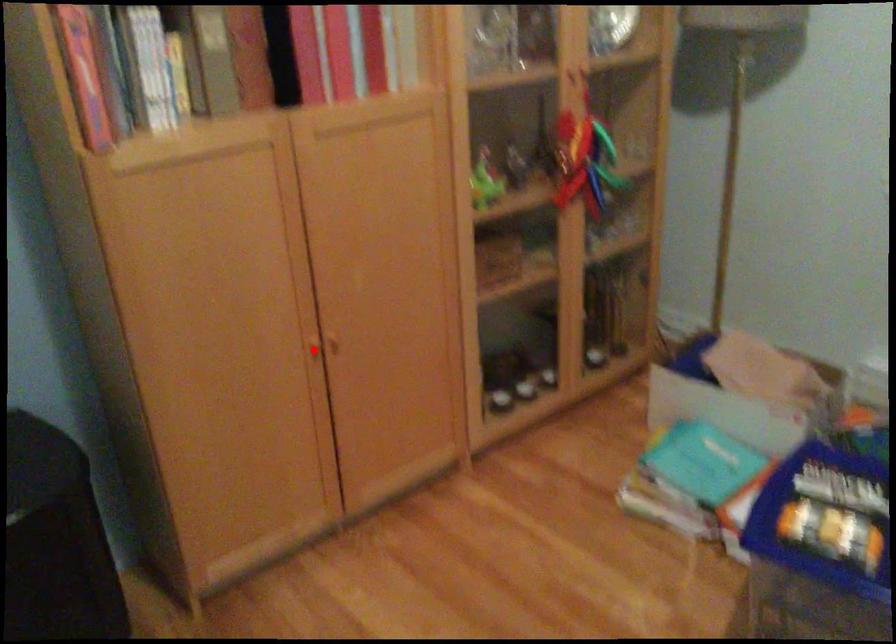
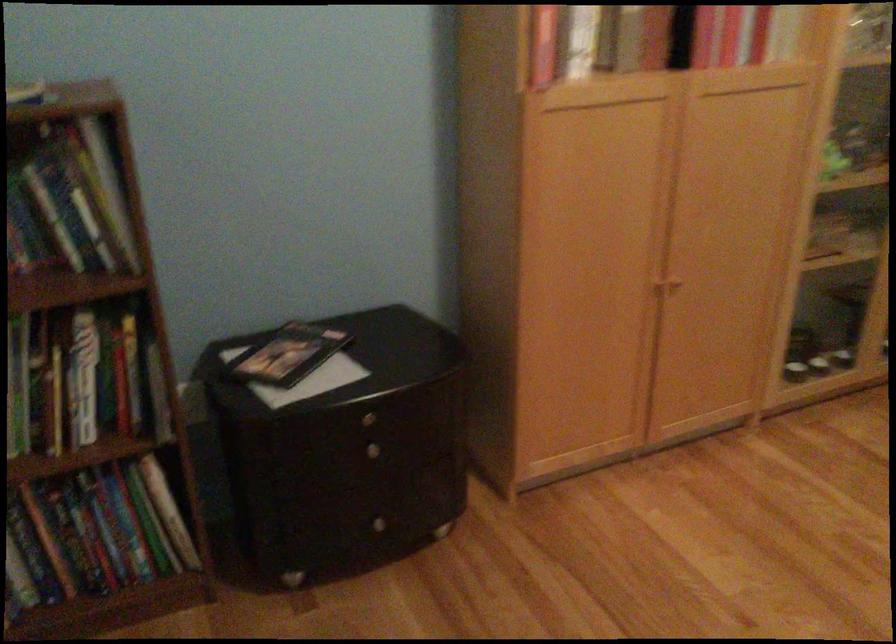
The point at the highlighted location is marked in the first image. Where is the corresponding point in the second image?

(653, 287)